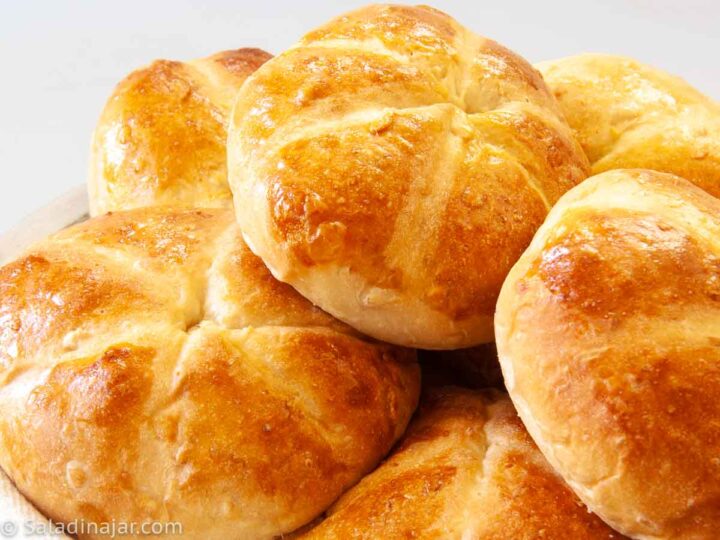
Where is `bowl`? The height and width of the screenshot is (540, 720). bowl is located at coordinates click(39, 516).